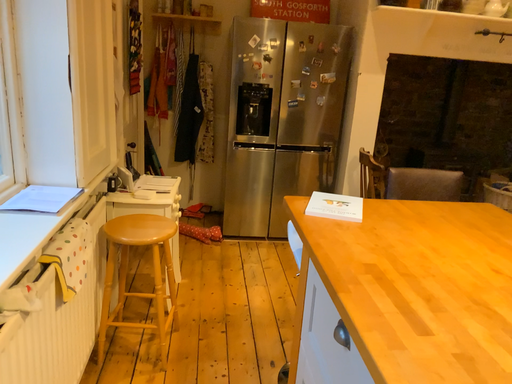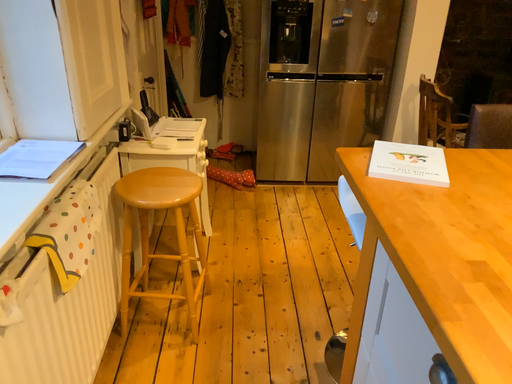
Question: How did the camera likely rotate when shooting the video?

Choices:
 (A) rotated downward
 (B) rotated upward

Answer: (A)